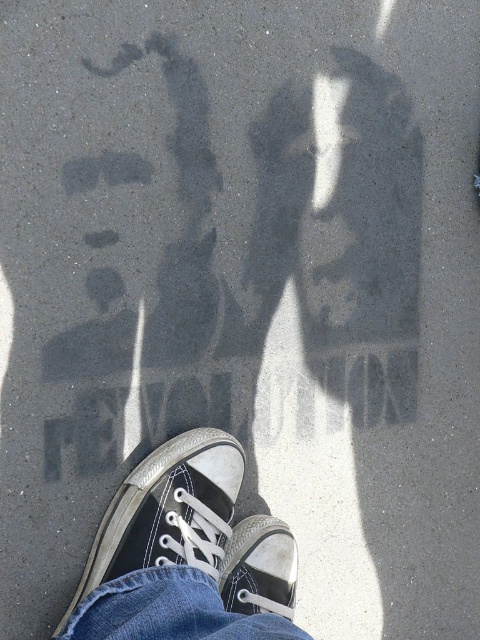
Measure the distance between black canvas shoe at lower center and black canvas shoe at center.

A distance of 4.32 inches exists between black canvas shoe at lower center and black canvas shoe at center.

Is the position of black canvas shoe at lower center more distant than that of black canvas shoe at center?

No, it is in front of black canvas shoe at center.

Between point (154, 548) and point (228, 579), which one is positioned behind?

Positioned behind is point (228, 579).

The image size is (480, 640). I want to click on black canvas shoe at lower center, so click(168, 512).